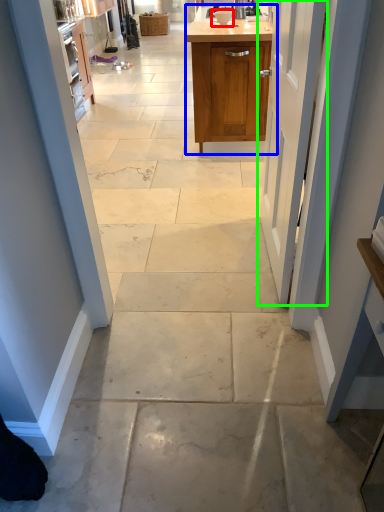
Question: Considering the real-world distances, which object is closest to appliance (highlighted by a red box)? cabinetry (highlighted by a blue box) or door (highlighted by a green box).

Choices:
 (A) cabinetry
 (B) door

Answer: (A)